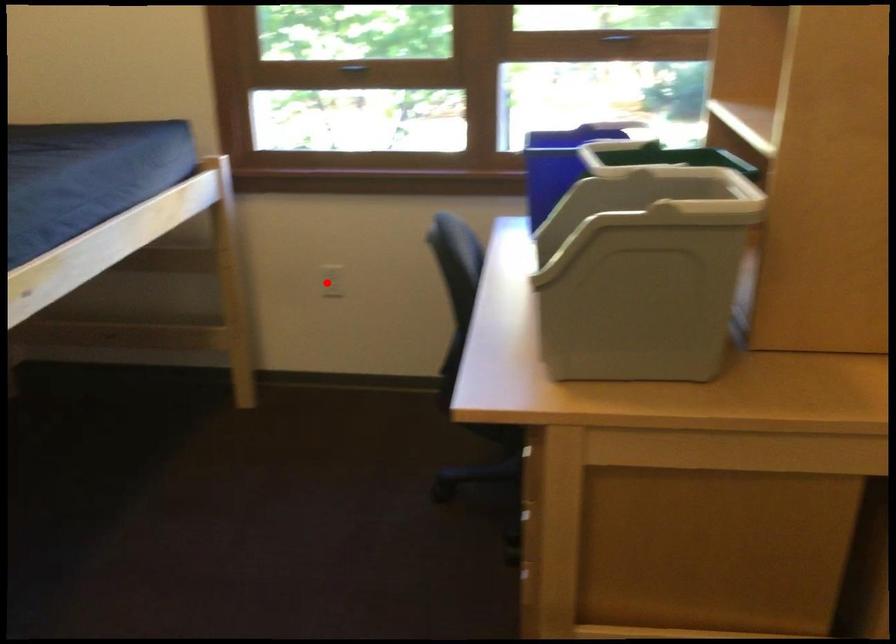
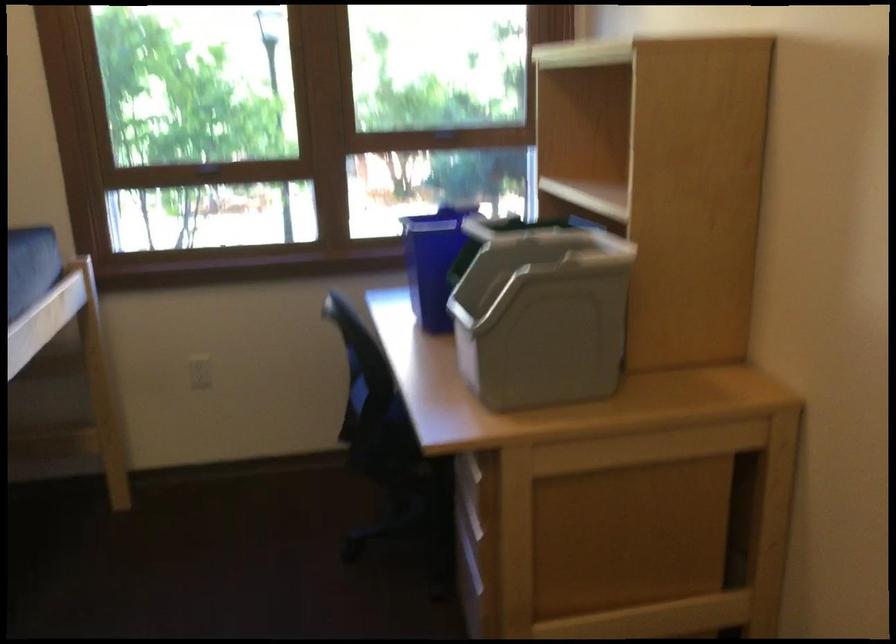
Locate, in the second image, the point that corresponds to the highlighted location in the first image.

(200, 372)